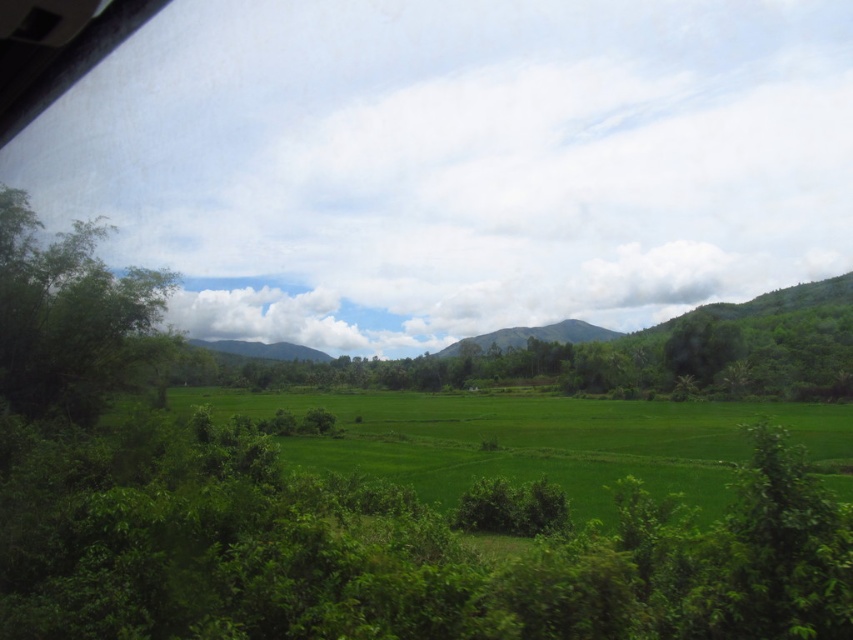
Is point (312, 396) positioned in front of point (136, 301)?

No, it is not.

Between point (670, 442) and point (167, 285), which one is positioned behind?

Point (670, 442)

Is point (428, 467) positioned after point (94, 326)?

Yes.

I want to click on green grassy field at center, so click(534, 440).